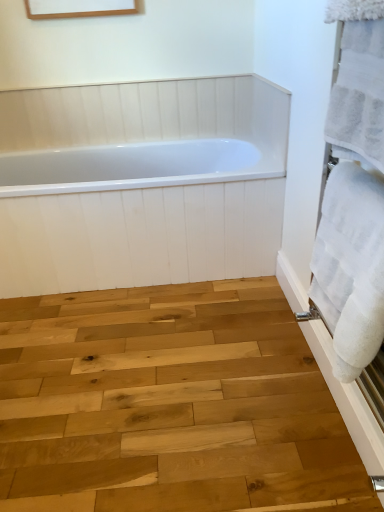
Question: Is white fluffy towel at right, the 2th bath towel positioned from the bottom, inside natural wood plank at center?

Choices:
 (A) no
 (B) yes

Answer: (A)

Question: Considering the relative positions of natural wood plank at center and white fluffy towel at right, which is counted as the first bath towel, starting from the top, in the image provided, is natural wood plank at center to the right of white fluffy towel at right, which is counted as the first bath towel, starting from the top, from the viewer's perspective?

Choices:
 (A) no
 (B) yes

Answer: (A)

Question: Considering the relative sizes of natural wood plank at center and white fluffy towel at right, which is counted as the first bath towel, starting from the top, in the image provided, is natural wood plank at center taller than white fluffy towel at right, which is counted as the first bath towel, starting from the top,?

Choices:
 (A) no
 (B) yes

Answer: (A)

Question: Is natural wood plank at center positioned far away from white fluffy towel at right, the 2th bath towel positioned from the bottom?

Choices:
 (A) no
 (B) yes

Answer: (B)

Question: Is natural wood plank at center not within white fluffy towel at right, which is counted as the first bath towel, starting from the top?

Choices:
 (A) yes
 (B) no

Answer: (A)

Question: From a real-world perspective, is natural wood plank at center above or below white glossy bathtub at center?

Choices:
 (A) above
 (B) below

Answer: (B)

Question: In terms of width, does natural wood plank at center look wider or thinner when compared to white glossy bathtub at center?

Choices:
 (A) thin
 (B) wide

Answer: (B)

Question: Based on their positions, is natural wood plank at center located to the left or right of white glossy bathtub at center?

Choices:
 (A) left
 (B) right

Answer: (B)

Question: Considering the positions of natural wood plank at center and white glossy bathtub at center in the image, is natural wood plank at center bigger or smaller than white glossy bathtub at center?

Choices:
 (A) small
 (B) big

Answer: (A)

Question: From the image's perspective, is white fluffy towel at right, the 2th bath towel positioned from the bottom, positioned above or below natural wood plank at center?

Choices:
 (A) above
 (B) below

Answer: (A)

Question: Considering their positions, is white fluffy towel at right, the 2th bath towel positioned from the bottom, located in front of or behind natural wood plank at center?

Choices:
 (A) behind
 (B) front

Answer: (B)

Question: Choose the correct answer: Is white fluffy towel at right, which is counted as the first bath towel, starting from the top, inside natural wood plank at center or outside it?

Choices:
 (A) outside
 (B) inside

Answer: (A)

Question: Looking at the image, does white fluffy towel at right, which is counted as the first bath towel, starting from the top, seem bigger or smaller compared to natural wood plank at center?

Choices:
 (A) small
 (B) big

Answer: (A)

Question: In the image, is white glossy bathtub at center positioned in front of or behind white soft towel at right, which is the 2th bath towel from top to bottom?

Choices:
 (A) behind
 (B) front

Answer: (A)

Question: Choose the correct answer: Is white glossy bathtub at center inside white soft towel at right, arranged as the first bath towel when ordered from the bottom, or outside it?

Choices:
 (A) outside
 (B) inside

Answer: (A)